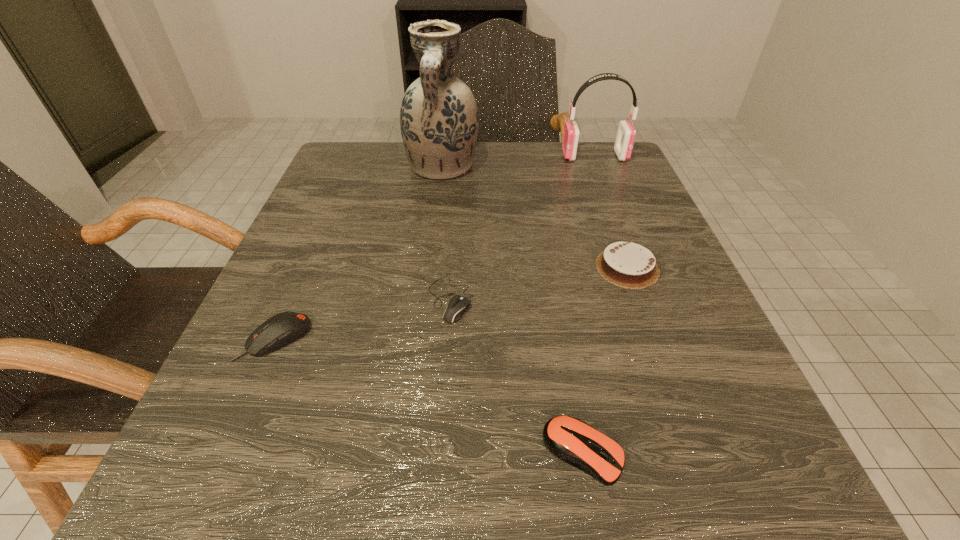
Locate which object ranks fifth in proximity to the fourth object from left to right. Please provide its 2D coordinates. Your answer should be formatted as a tuple, i.e. [(x, y)], where the tuple contains the x and y coordinates of a point satisfying the conditions above.

[(626, 133)]

Find the location of a particular element. This screenshot has height=540, width=960. the second closest computer mouse relative to the leftmost object is located at coordinates (570, 439).

Locate which computer mouse ranks in proximity to the leftmost object. Please provide its 2D coordinates. Your answer should be formatted as a tuple, i.e. [(x, y)], where the tuple contains the x and y coordinates of a point satisfying the conditions above.

[(457, 305)]

Locate an element on the screen. free space that satisfies the following two spatial constraints: 1. on the outer surface of the fifth shortest object; 2. with the handle on the side of the vase is located at coordinates (599, 167).

This screenshot has height=540, width=960. Identify the location of free point that satisfies the following two spatial constraints: 1. with the handle on the side of the tallest object; 2. on the right side of the nearest object. (407, 452).

You are a GUI agent. You are given a task and a screenshot of the screen. Output one action in this format:
    pyautogui.click(x=<x>, y=<y>)
    Task: Click on the free spot that satisfies the following two spatial constraints: 1. on the back side of the second computer mouse from right to left; 2. on the right side of the leftmost object
    This screenshot has width=960, height=540.
    Given the screenshot: What is the action you would take?
    pyautogui.click(x=292, y=299)

Image resolution: width=960 pixels, height=540 pixels. What are the coordinates of `free location that satisfies the following two spatial constraints: 1. with the handle on the side of the chocolate cake; 2. on the right side of the tallest object` in the screenshot? It's located at (430, 268).

Locate an element on the screen. vacant space that satisfies the following two spatial constraints: 1. on the outer surface of the fifth shortest object; 2. with the handle on the side of the vase is located at coordinates (599, 167).